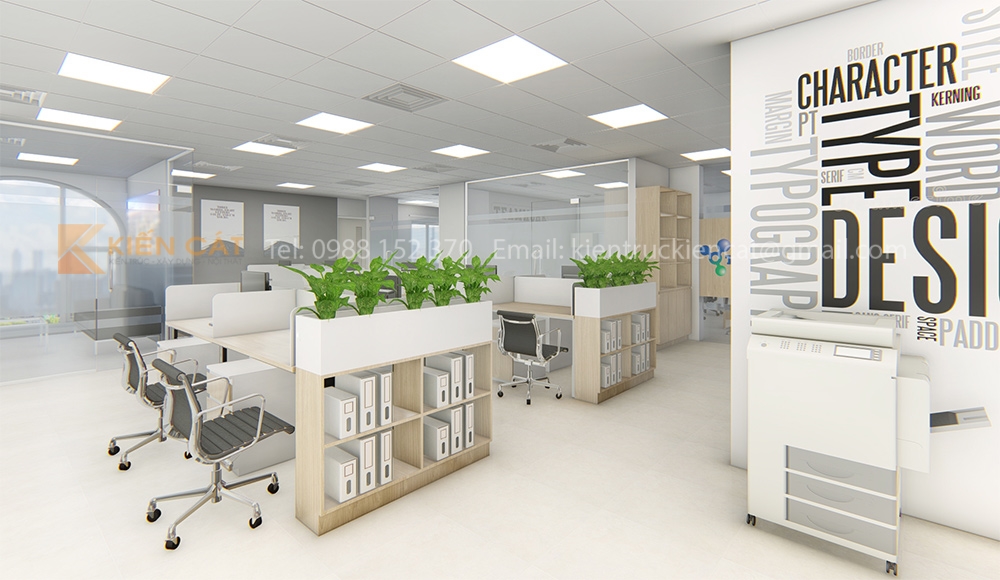
The image size is (1000, 580). I want to click on floor, so click(562, 507).